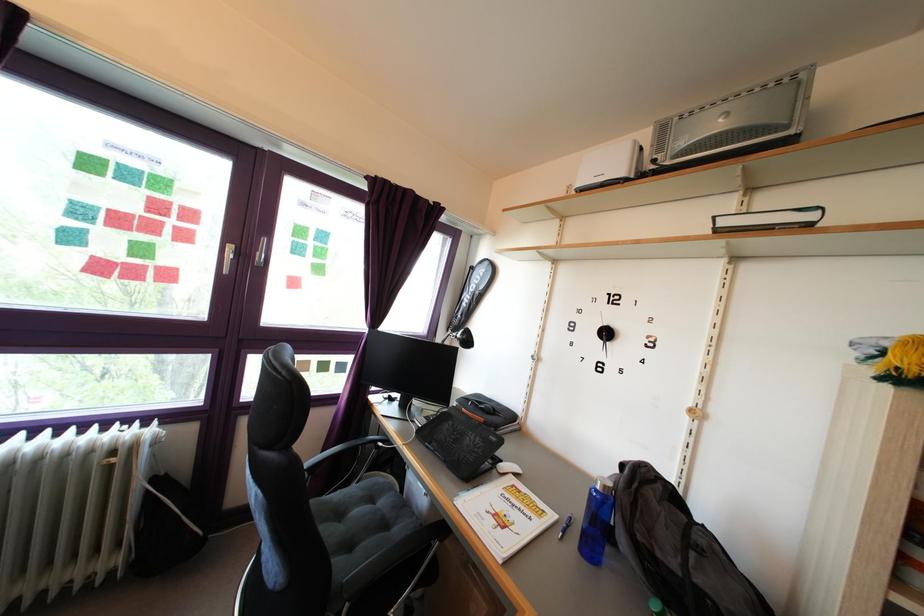
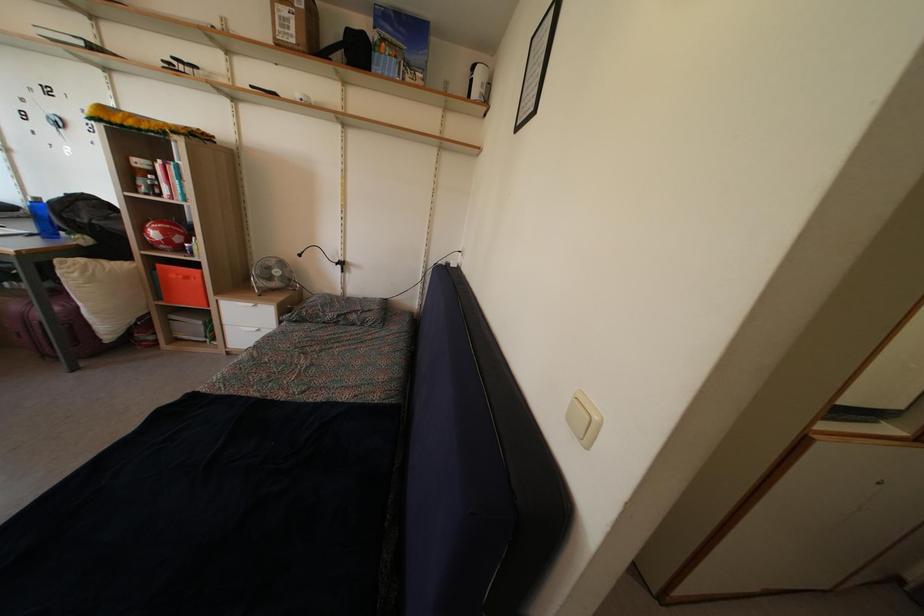
Where in the second image is the point corresponding to (609,496) from the first image?

(40, 208)